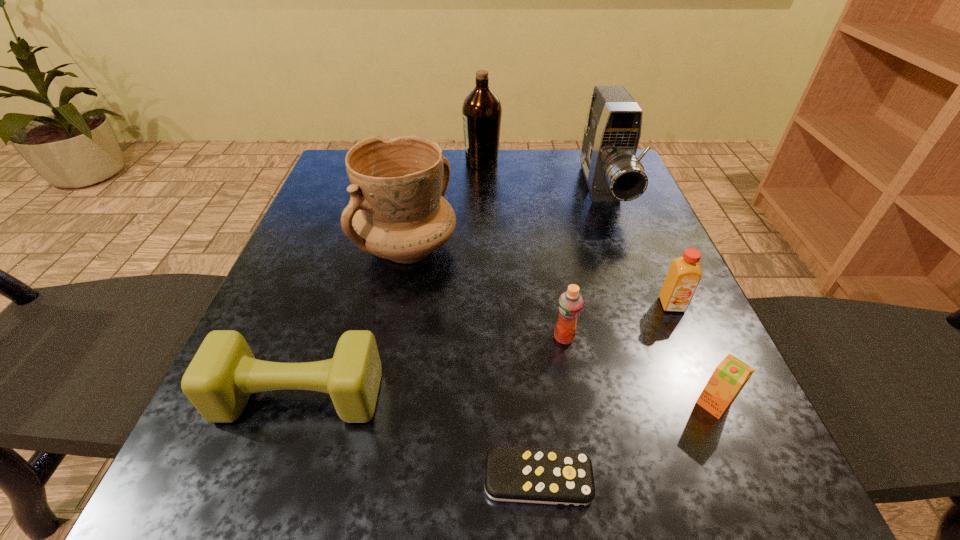
What are the coordinates of `blank space at the far left corner of the desktop` in the screenshot? It's located at (347, 149).

I want to click on free point between the fifth nearest object and the fifth farthest object, so click(x=618, y=321).

This screenshot has height=540, width=960. Identify the location of free point between the nearest orange juice and the nearest object. (626, 441).

Find the location of a particular element. This screenshot has height=540, width=960. unoccupied area between the pottery and the farthest orange juice is located at coordinates (540, 276).

Locate an element on the screen. This screenshot has height=540, width=960. vacant region between the shortest object and the farthest orange juice is located at coordinates (605, 392).

This screenshot has width=960, height=540. In order to click on vacant region between the remote control and the dumbbell in this screenshot , I will do `click(419, 437)`.

Locate an element on the screen. Image resolution: width=960 pixels, height=540 pixels. free space between the fifth farthest object and the camcorder is located at coordinates (584, 264).

Find the location of a particular element. This screenshot has height=540, width=960. free space between the fifth nearest object and the pottery is located at coordinates (540, 276).

Where is `unoccupied position between the dumbbell and the nearest object`? unoccupied position between the dumbbell and the nearest object is located at coordinates (419, 437).

Locate an element on the screen. The image size is (960, 540). vacant area that lies between the camcorder and the pottery is located at coordinates (506, 219).